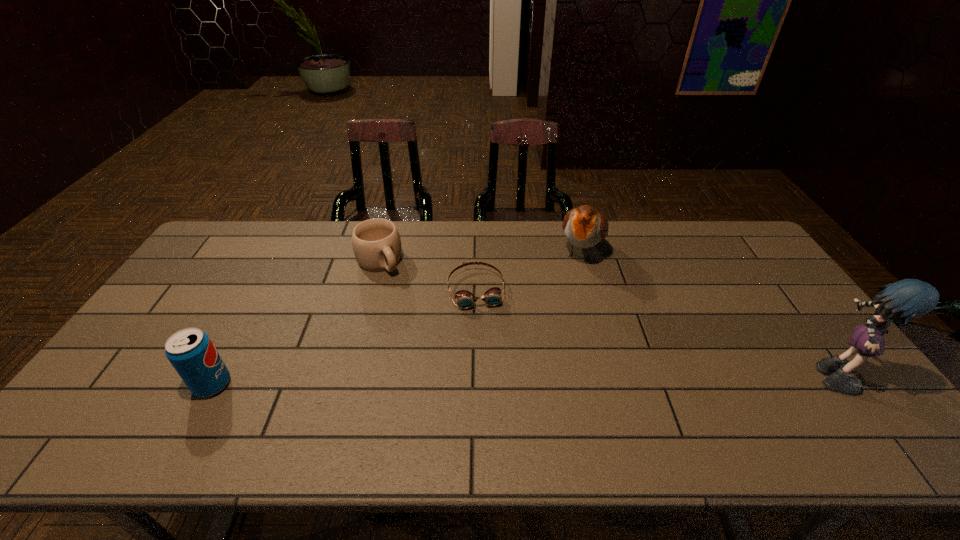
This screenshot has width=960, height=540. Find the location of `mug at the far edge`. mug at the far edge is located at coordinates (376, 242).

Locate an element on the screen. The image size is (960, 540). bird positioned at the far edge is located at coordinates (584, 227).

Identify the location of soda can present at the near edge. (191, 352).

Find the location of a particular element. This screenshot has height=540, width=960. rag doll situated at the near edge is located at coordinates [x=908, y=299].

Where is `object situated at the right edge`? This screenshot has height=540, width=960. object situated at the right edge is located at coordinates (908, 299).

Image resolution: width=960 pixels, height=540 pixels. Find the location of `object present at the near right corner`. object present at the near right corner is located at coordinates 908,299.

The width and height of the screenshot is (960, 540). Find the location of `free space at the far edge of the desktop`. free space at the far edge of the desktop is located at coordinates (347, 249).

Identify the location of vacant space at the near edge of the desktop. (393, 388).

Where is `vacant space at the left edge of the desktop`? vacant space at the left edge of the desktop is located at coordinates (231, 279).

Locate an element on the screen. free space at the right edge is located at coordinates (780, 289).